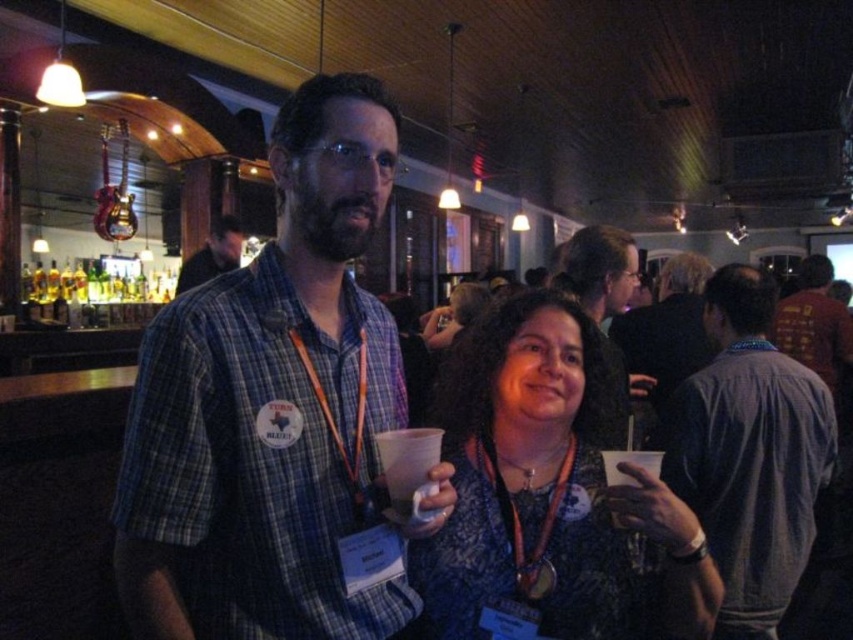
You are at a social event and want to introduce yourself to the people in the image. Which person should you approach first, the gray fabric shirt at right or the red shirt at center, if you want to speak to the one closer to the entrance?

The gray fabric shirt at right is positioned under the red shirt at center, so the red shirt at center is closer to the entrance. Approach the red shirt at center first.

You are a photographer at the event and want to ensure both the blue lace dress at center and the matte plaid shirt at center are visible in your photo. Which clothing item should you focus on to ensure the other is still in frame?

The blue lace dress at center is taller than the matte plaid shirt at center. To ensure both are visible, focus on the taller blue lace dress at center, as the shorter matte plaid shirt at center will naturally be within the frame.